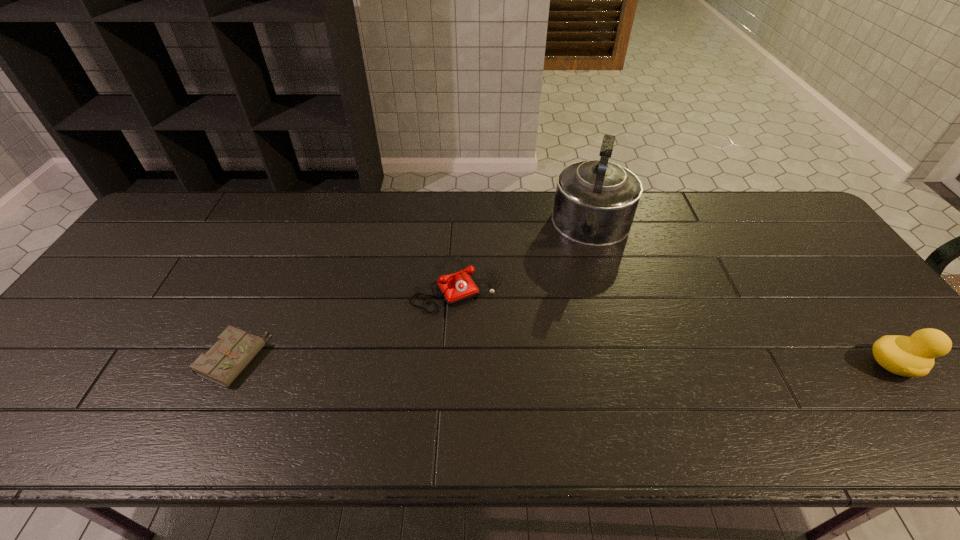
Find the location of a particular element. empty space between the diary and the second object from right to left is located at coordinates (413, 293).

What are the coordinates of `vacant region between the leftmost object and the kettle` in the screenshot? It's located at (413, 293).

I want to click on free area in between the tallest object and the second shortest object, so click(x=524, y=256).

Identify the location of free area in between the telephone and the second tallest object. (x=674, y=325).

Identify the location of free spot between the diary and the second object from right to left. (413, 293).

Locate an element on the screen. unoccupied area between the leftmost object and the duck is located at coordinates (563, 362).

What are the coordinates of `the closest object to the leftmost object` in the screenshot? It's located at (455, 288).

You are a GUI agent. You are given a task and a screenshot of the screen. Output one action in this format:
    pyautogui.click(x=<x>, y=<y>)
    Task: Click on the closest object to the second object from left to right
    This screenshot has height=540, width=960.
    Given the screenshot: What is the action you would take?
    pyautogui.click(x=595, y=202)

At what (x,y) coordinates should I click in order to perform the action: click on vacant point that satisfies the following two spatial constraints: 1. on the back side of the leftmost object; 2. on the left side of the third tallest object. Please return your answer as a coordinate pair (x, y). Looking at the image, I should click on (267, 285).

You are a GUI agent. You are given a task and a screenshot of the screen. Output one action in this format:
    pyautogui.click(x=<x>, y=<y>)
    Task: Click on the vacant space that satisfies the following two spatial constraints: 1. on the front side of the kettle; 2. on the front-facing side of the duck
    This screenshot has height=540, width=960.
    Given the screenshot: What is the action you would take?
    pyautogui.click(x=632, y=365)